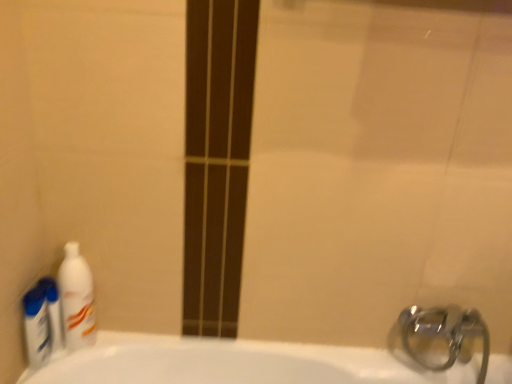
Question: Is white glossy bottle at left, which is the 1th cleaning product in right-to-left order, looking in the opposite direction of white glossy mouthwash at left?

Choices:
 (A) no
 (B) yes

Answer: (B)

Question: Does white glossy bottle at left, which is the 1th cleaning product in right-to-left order, appear on the right side of white glossy mouthwash at left?

Choices:
 (A) yes
 (B) no

Answer: (A)

Question: From the image's perspective, is white glossy bottle at left, which is the 1th cleaning product in right-to-left order, on top of white glossy mouthwash at left?

Choices:
 (A) no
 (B) yes

Answer: (B)

Question: Is the position of white glossy bottle at left, which is the 1th cleaning product in right-to-left order, less distant than that of white glossy mouthwash at left?

Choices:
 (A) yes
 (B) no

Answer: (A)

Question: Does white glossy bottle at left, which is the 1th cleaning product in right-to-left order, have a larger size compared to white glossy mouthwash at left?

Choices:
 (A) no
 (B) yes

Answer: (B)

Question: Based on their positions, is blue plastic bottles at left, which is the 2th cleaning product from right to left, located to the left or right of white glossy bottle at left, which is the 2th cleaning product from left to right?

Choices:
 (A) left
 (B) right

Answer: (A)

Question: In terms of size, does blue plastic bottles at left, arranged as the 1th cleaning product when viewed from the left, appear bigger or smaller than white glossy bottle at left, which is the 1th cleaning product in right-to-left order?

Choices:
 (A) big
 (B) small

Answer: (B)

Question: From the image's perspective, is blue plastic bottles at left, which is the 2th cleaning product from right to left, located above or below white glossy bottle at left, which is the 1th cleaning product in right-to-left order?

Choices:
 (A) above
 (B) below

Answer: (B)

Question: Is blue plastic bottles at left, which is the 2th cleaning product from right to left, inside the boundaries of white glossy bottle at left, which is the 1th cleaning product in right-to-left order, or outside?

Choices:
 (A) outside
 (B) inside

Answer: (A)

Question: From the image's perspective, is blue plastic bottles at left, arranged as the 1th cleaning product when viewed from the left, above or below white glossy mouthwash at left?

Choices:
 (A) below
 (B) above

Answer: (A)

Question: In terms of height, does blue plastic bottles at left, arranged as the 1th cleaning product when viewed from the left, look taller or shorter compared to white glossy mouthwash at left?

Choices:
 (A) tall
 (B) short

Answer: (B)

Question: Choose the correct answer: Is blue plastic bottles at left, arranged as the 1th cleaning product when viewed from the left, inside white glossy mouthwash at left or outside it?

Choices:
 (A) outside
 (B) inside

Answer: (A)

Question: From a real-world perspective, is blue plastic bottles at left, which is the 2th cleaning product from right to left, physically located above or below white glossy mouthwash at left?

Choices:
 (A) below
 (B) above

Answer: (A)

Question: Based on their positions, is white glossy bottle at left, which is the 1th cleaning product in right-to-left order, located to the left or right of blue plastic bottles at left, which is the 2th cleaning product from right to left?

Choices:
 (A) right
 (B) left

Answer: (A)

Question: In the image, is white glossy bottle at left, which is the 1th cleaning product in right-to-left order, positioned in front of or behind blue plastic bottles at left, arranged as the 1th cleaning product when viewed from the left?

Choices:
 (A) behind
 (B) front

Answer: (A)